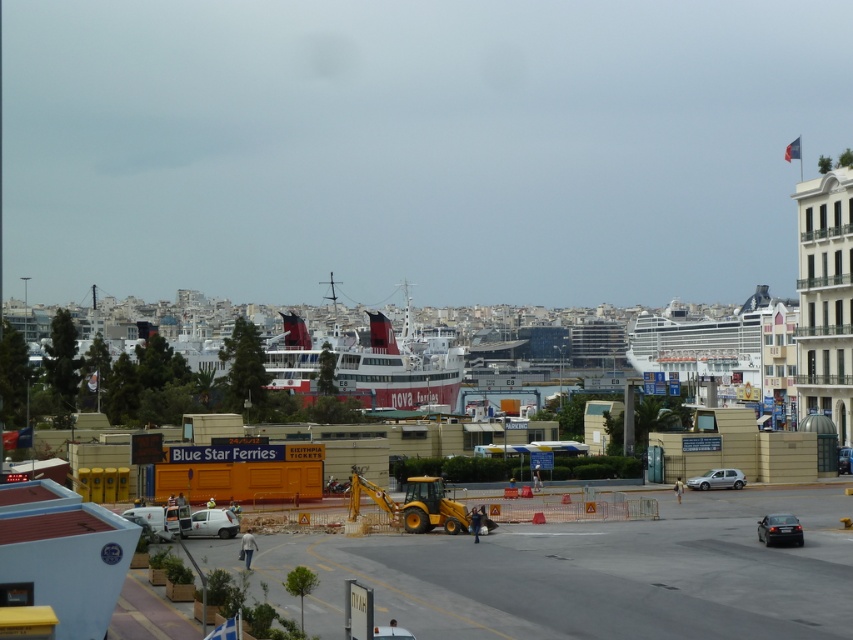
Is point (223, 515) behind point (689, 481)?

That is False.

Which is behind, point (201, 531) or point (727, 474)?

The point (727, 474) is more distant.

Locate an element on the screen. This screenshot has width=853, height=640. white matte van at center is located at coordinates (212, 524).

How far apart are black glossy car at lower right and silver metallic car at center?

They are 30.73 meters apart.

Where is `black glossy car at lower right`? The width and height of the screenshot is (853, 640). black glossy car at lower right is located at coordinates (779, 529).

Is point (778, 513) more distant than point (718, 474)?

No, it is not.

This screenshot has width=853, height=640. In order to click on black glossy car at lower right in this screenshot , I will do `click(779, 529)`.

Who is more forward, (683,365) or (210,532)?

Positioned in front is point (210,532).

How far apart are white glossy cruise ship at center and white matte van at center?

134.38 meters

The width and height of the screenshot is (853, 640). Describe the element at coordinates (712, 342) in the screenshot. I see `white glossy cruise ship at center` at that location.

The image size is (853, 640). Identify the location of white glossy cruise ship at center. (712, 342).